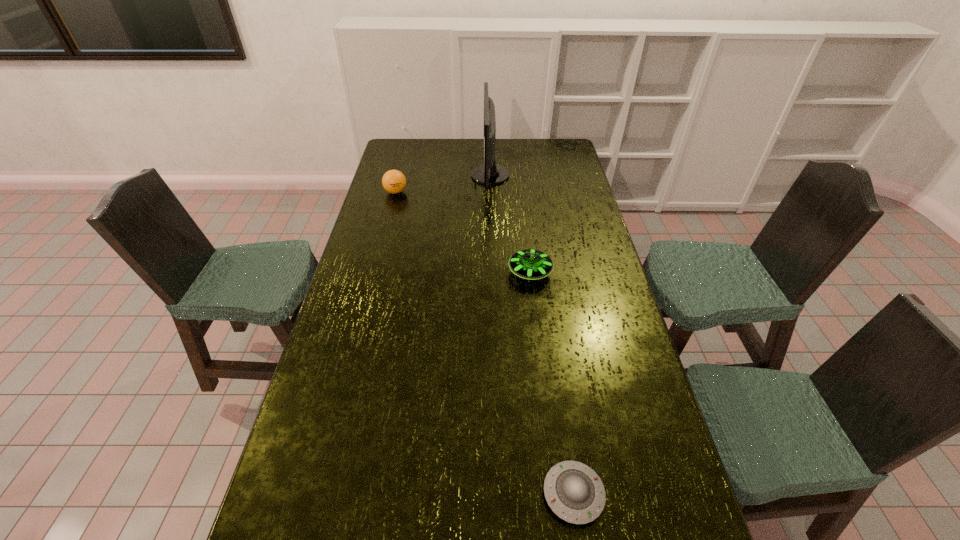
What are the coordinates of `vacant area that lies between the nearer saucer and the leftmost object` in the screenshot? It's located at [485, 343].

At what (x,y) coordinates should I click in order to perform the action: click on empty space that is in between the third shortest object and the monitor. Please return your answer as a coordinate pair (x, y). This screenshot has height=540, width=960. Looking at the image, I should click on (443, 184).

I want to click on vacant space that's between the shorter saucer and the tallest object, so click(x=532, y=335).

In order to click on vacant area between the monitor and the ping-pong ball in this screenshot , I will do coord(443,184).

Locate an element on the screen. The image size is (960, 540). free space between the tallest object and the third shortest object is located at coordinates (443, 184).

Locate an element on the screen. vacant region between the second tallest object and the nearer saucer is located at coordinates (485, 343).

The height and width of the screenshot is (540, 960). I want to click on vacant area that lies between the nearest object and the leftmost object, so click(x=485, y=343).

Find the location of a particular element. vacant point located between the leftmost object and the second shortest object is located at coordinates (463, 232).

Where is `empty space between the monitor and the shortest object`? empty space between the monitor and the shortest object is located at coordinates (532, 335).

You are a GUI agent. You are given a task and a screenshot of the screen. Output one action in this format:
    pyautogui.click(x=<x>, y=<y>)
    Task: Click on the third closest object to the third shortest object
    
    Given the screenshot: What is the action you would take?
    pyautogui.click(x=575, y=493)